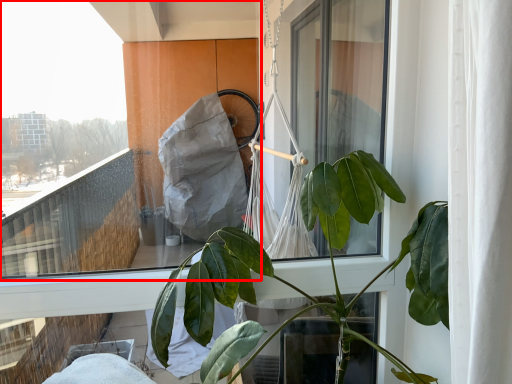
Question: Where is window (annotated by the red box) located in relation to houseplant in the image?

Choices:
 (A) right
 (B) left

Answer: (B)